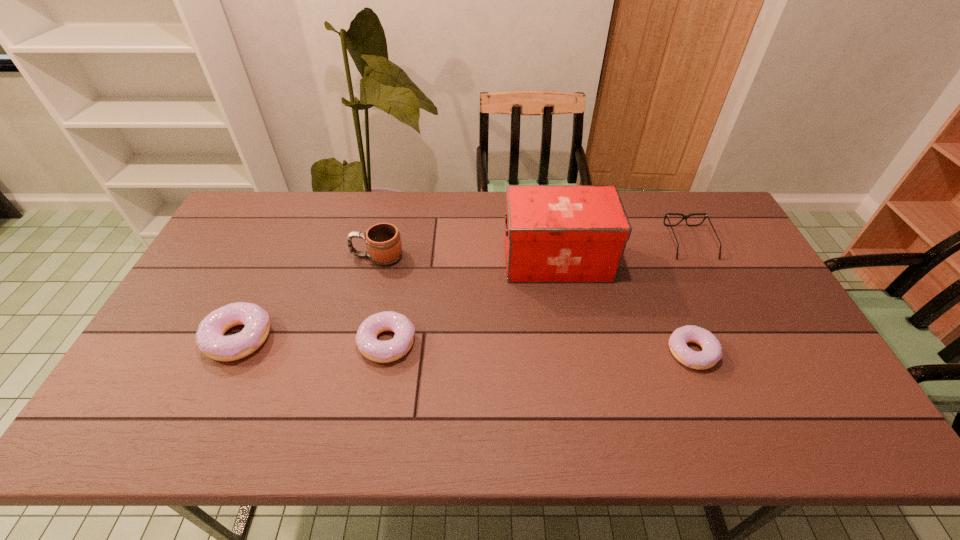
Identify the location of blank region between the second doughnut from left to right and the fifth shortest object. The height and width of the screenshot is (540, 960). (382, 300).

You are a GUI agent. You are given a task and a screenshot of the screen. Output one action in this format:
    pyautogui.click(x=<x>, y=<y>)
    Task: Click on the free spot between the rightmost doughnut and the third object from right to left
    Image resolution: width=960 pixels, height=540 pixels.
    Given the screenshot: What is the action you would take?
    pyautogui.click(x=625, y=306)

The width and height of the screenshot is (960, 540). Identify the location of free space between the spectacles and the leftmost object. (464, 290).

Where is `free point between the rightmost doughnut and the mug`? This screenshot has height=540, width=960. free point between the rightmost doughnut and the mug is located at coordinates (535, 305).

Locate an element on the screen. vacant area between the tallest object and the leftmost doughnut is located at coordinates (397, 299).

Where is `vacant space that is in between the second doughnut from left to right and the tallest object`? The width and height of the screenshot is (960, 540). vacant space that is in between the second doughnut from left to right and the tallest object is located at coordinates (472, 301).

This screenshot has width=960, height=540. I want to click on object that stands as the fourth closest to the second doughnut from left to right, so click(x=711, y=353).

Select which object is the closest to the rightmost doughnut. Please provide its 2D coordinates. Your answer should be formatted as a tuple, i.e. [(x, y)], where the tuple contains the x and y coordinates of a point satisfying the conditions above.

[(553, 233)]

I want to click on doughnut that is the closest to the third object from right to left, so click(711, 353).

Select which doughnut is the closest to the second shortest doughnut. Please provide its 2D coordinates. Your answer should be formatted as a tuple, i.e. [(x, y)], where the tuple contains the x and y coordinates of a point satisfying the conditions above.

[(210, 339)]